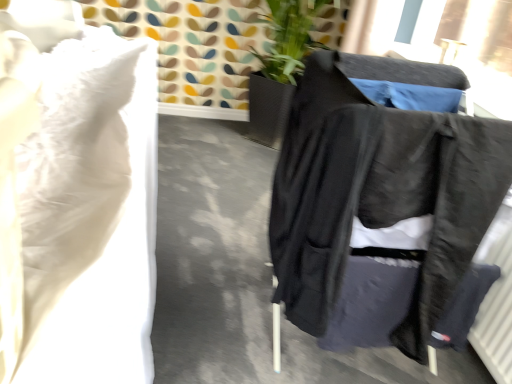
Question: Should I look upward or downward to see white soft pillow at upper left?

Choices:
 (A) up
 (B) down

Answer: (A)

Question: Is black fabric jacket at right wider than white soft pillow at upper left?

Choices:
 (A) no
 (B) yes

Answer: (A)

Question: From a real-world perspective, is black fabric jacket at right on top of white soft pillow at upper left?

Choices:
 (A) no
 (B) yes

Answer: (B)

Question: Is black fabric jacket at right thinner than white soft pillow at upper left?

Choices:
 (A) yes
 (B) no

Answer: (A)

Question: Does black fabric jacket at right appear on the right side of white soft pillow at upper left?

Choices:
 (A) no
 (B) yes

Answer: (B)

Question: From a real-world perspective, is black fabric jacket at right below white soft pillow at upper left?

Choices:
 (A) yes
 (B) no

Answer: (B)

Question: From the image's perspective, does black fabric jacket at right appear lower than white soft pillow at upper left?

Choices:
 (A) no
 (B) yes

Answer: (B)

Question: Can you confirm if white soft pillow at upper left is taller than black fabric jacket at right?

Choices:
 (A) no
 (B) yes

Answer: (A)

Question: Does white soft pillow at upper left have a larger size compared to black fabric jacket at right?

Choices:
 (A) no
 (B) yes

Answer: (B)

Question: Considering the relative sizes of white soft pillow at upper left and black fabric jacket at right in the image provided, is white soft pillow at upper left thinner than black fabric jacket at right?

Choices:
 (A) no
 (B) yes

Answer: (A)

Question: From a real-world perspective, is white soft pillow at upper left beneath black fabric jacket at right?

Choices:
 (A) no
 (B) yes

Answer: (B)

Question: Considering the relative sizes of white soft pillow at upper left and black fabric jacket at right in the image provided, is white soft pillow at upper left smaller than black fabric jacket at right?

Choices:
 (A) yes
 (B) no

Answer: (B)

Question: Can you confirm if white soft pillow at upper left is positioned to the right of black fabric jacket at right?

Choices:
 (A) no
 (B) yes

Answer: (A)

Question: From a real-world perspective, is white soft pillow at upper left physically located above or below black fabric jacket at right?

Choices:
 (A) below
 (B) above

Answer: (A)